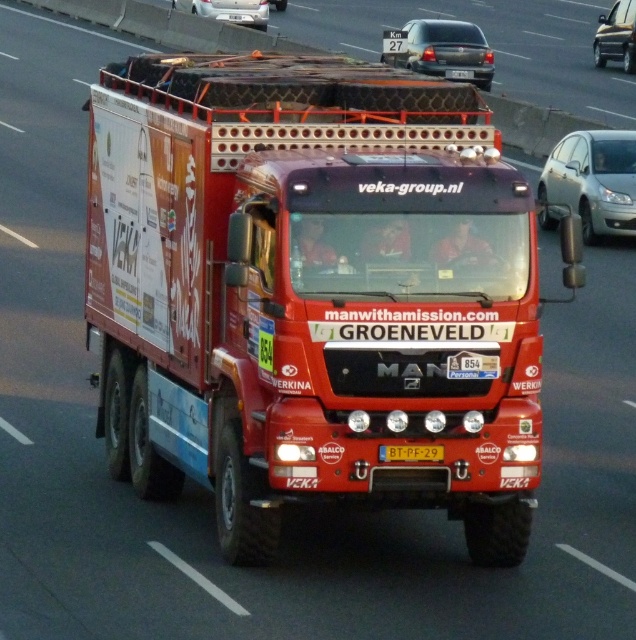
Does point (232, 454) come farther from viewer compared to point (410, 19)?

No, (232, 454) is closer to viewer.

Can you confirm if shiny red truck at center is thinner than matte black sedan at upper center?

Yes, shiny red truck at center is thinner than matte black sedan at upper center.

Is point (480, 451) farther from camera compared to point (418, 38)?

No, (480, 451) is in front of (418, 38).

Image resolution: width=636 pixels, height=640 pixels. In order to click on shiny red truck at center in this screenshot , I will do click(x=312, y=292).

Who is taller, shiny red truck at center or metallic silver car at upper right?

shiny red truck at center

What do you see at coordinates (312, 292) in the screenshot? Image resolution: width=636 pixels, height=640 pixels. I see `shiny red truck at center` at bounding box center [312, 292].

I want to click on shiny red truck at center, so click(x=312, y=292).

Is the position of satin silver sedan at right less distant than that of matte black sedan at upper center?

Yes, it is.

Locate an element on the screen. Image resolution: width=636 pixels, height=640 pixels. satin silver sedan at right is located at coordinates (590, 182).

At what (x,y) coordinates should I click in order to perform the action: click on satin silver sedan at right. Please return your answer as a coordinate pair (x, y). Image resolution: width=636 pixels, height=640 pixels. Looking at the image, I should click on (590, 182).